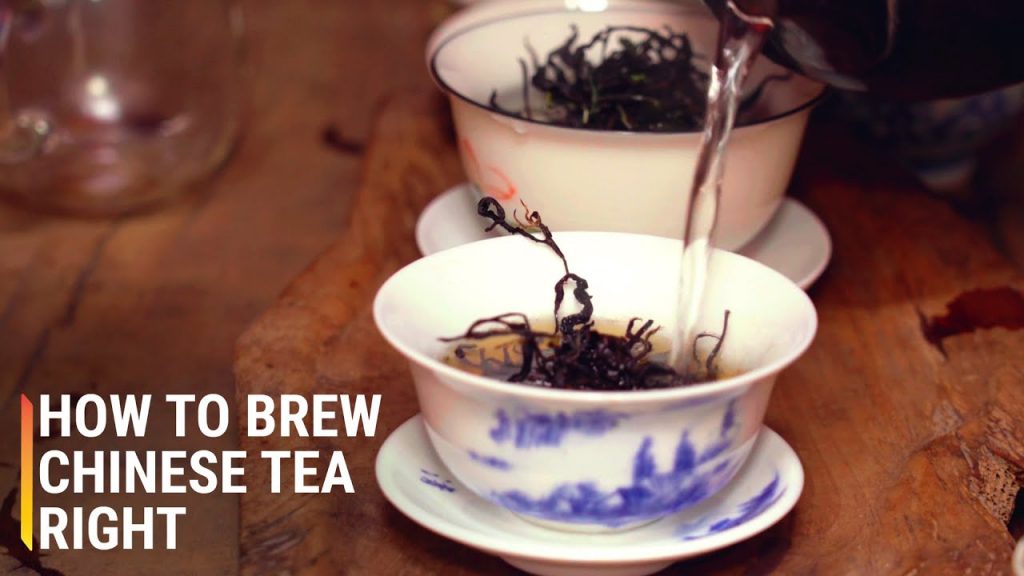
You are a GUI agent. You are given a task and a screenshot of the screen. Output one action in this format:
    pyautogui.click(x=<x>, y=<y>)
    Task: Click on the table
    This screenshot has height=576, width=1024.
    Given the screenshot: What is the action you would take?
    pyautogui.click(x=270, y=217)